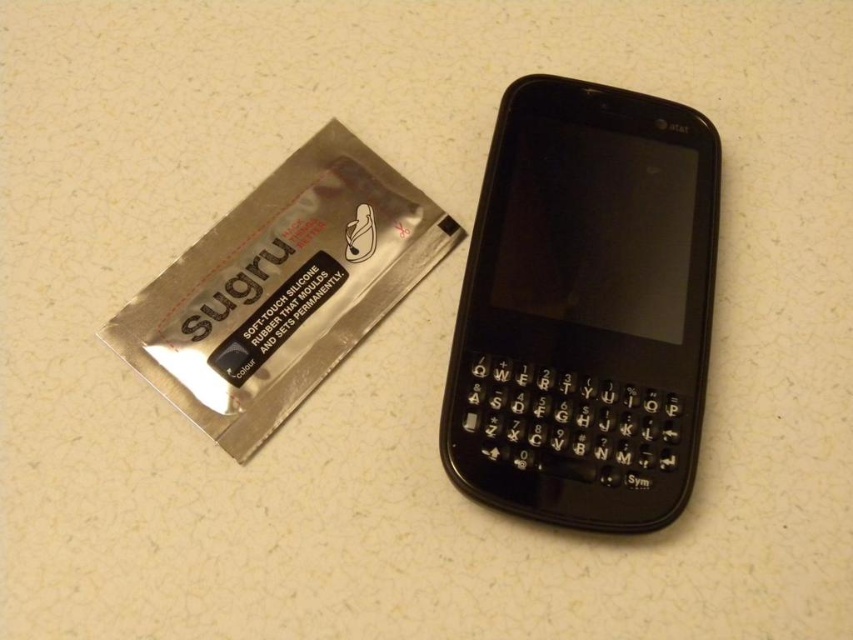
Which of these two, black plastic smartphone at center or silver/silicone sugru at left, stands shorter?

Standing shorter between the two is silver/silicone sugru at left.

Which is above, black plastic smartphone at center or silver/silicone sugru at left?

silver/silicone sugru at left is higher up.

Looking at this image, who is more forward, [514,182] or [289,323]?

Point [289,323] is more forward.

Identify the location of black plastic smartphone at center. This screenshot has width=853, height=640. (585, 308).